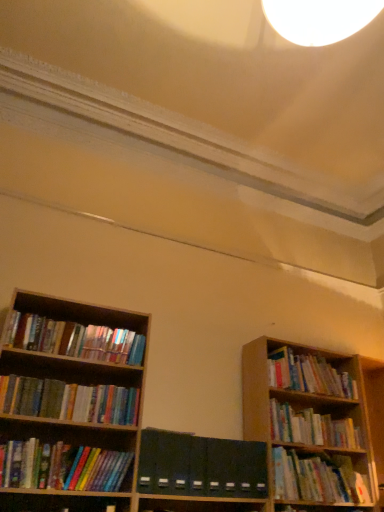
Where is `dark green matte folder at center`? This screenshot has width=384, height=512. dark green matte folder at center is located at coordinates (201, 465).

Locate an element on the screen. hardcover books at right, which is the 5th book in left-to-right order is located at coordinates (312, 428).

The width and height of the screenshot is (384, 512). Identify the location of hardcover books at left, which ranks as the fifth book in right-to-left order. (74, 339).

Describe the element at coordinates (317, 478) in the screenshot. I see `hardcover books at lower right, which appears as the 4th book when viewed from the left` at that location.

This screenshot has height=512, width=384. In order to click on hardcover books at lower right, the third book positioned from the right in this screenshot , I will do `click(317, 478)`.

Find the location of `wooden bookshelf at right, which is the 6th book in left-to-right order`. wooden bookshelf at right, which is the 6th book in left-to-right order is located at coordinates (308, 374).

Could you tell me if hardcover books at lower left, the 3th book in the left-to-right sequence, is facing dark green matte folder at center?

No, hardcover books at lower left, the 3th book in the left-to-right sequence, is not turned towards dark green matte folder at center.

Could you measure the distance between hardcover books at lower left, the 3th book in the left-to-right sequence, and dark green matte folder at center?

16.04 inches.

From the image's perspective, which is above, hardcover books at lower left, the fourth book in the right-to-left sequence, or dark green matte folder at center?

hardcover books at lower left, the fourth book in the right-to-left sequence, appears higher in the image.

Considering the relative sizes of hardcover books at lower left, the fourth book in the right-to-left sequence, and dark green matte folder at center in the image provided, is hardcover books at lower left, the fourth book in the right-to-left sequence, shorter than dark green matte folder at center?

Yes, hardcover books at lower left, the fourth book in the right-to-left sequence, is shorter than dark green matte folder at center.

Is hardcover books at lower right, which appears as the 4th book when viewed from the left, to the right of multicolored paperbacks at left, acting as the first book starting from the left, from the viewer's perspective?

Yes.

Who is taller, hardcover books at lower right, the third book positioned from the right, or multicolored paperbacks at left, which is the 6th book in right-to-left order?

Standing taller between the two is hardcover books at lower right, the third book positioned from the right.

Considering the sizes of hardcover books at lower right, which appears as the 4th book when viewed from the left, and multicolored paperbacks at left, acting as the first book starting from the left, in the image, is hardcover books at lower right, which appears as the 4th book when viewed from the left, bigger or smaller than multicolored paperbacks at left, acting as the first book starting from the left,?

Considering their sizes, hardcover books at lower right, which appears as the 4th book when viewed from the left, takes up more space than multicolored paperbacks at left, acting as the first book starting from the left.

Is hardcover books at lower right, which appears as the 4th book when viewed from the left, positioned with its back to multicolored paperbacks at left, acting as the first book starting from the left?

No, hardcover books at lower right, which appears as the 4th book when viewed from the left, is not facing the opposite direction of multicolored paperbacks at left, acting as the first book starting from the left.

Could you tell me if dark green matte folder at center is turned towards hardcover books at left, the second book viewed from the left?

No, dark green matte folder at center is not turned towards hardcover books at left, the second book viewed from the left.

Considering the points (244, 469) and (29, 349), which point is in front, point (244, 469) or point (29, 349)?

Point (29, 349)

From a real-world perspective, between dark green matte folder at center and hardcover books at left, which ranks as the fifth book in right-to-left order, who is vertically lower?

dark green matte folder at center.

Is dark green matte folder at center outside of hardcover books at left, which ranks as the fifth book in right-to-left order?

Absolutely, dark green matte folder at center is external to hardcover books at left, which ranks as the fifth book in right-to-left order.

Can you confirm if hardcover books at lower left, the fourth book in the right-to-left sequence, is thinner than hardcover books at right, the 2th book positioned from the right?

Indeed, hardcover books at lower left, the fourth book in the right-to-left sequence, has a lesser width compared to hardcover books at right, the 2th book positioned from the right.

From the image's perspective, between hardcover books at lower left, the fourth book in the right-to-left sequence, and hardcover books at right, the 2th book positioned from the right, who is located below?

hardcover books at right, the 2th book positioned from the right, is shown below in the image.

Are hardcover books at lower left, the 3th book in the left-to-right sequence, and hardcover books at right, the 2th book positioned from the right, making contact?

There is a gap between hardcover books at lower left, the 3th book in the left-to-right sequence, and hardcover books at right, the 2th book positioned from the right.

Considering the sizes of hardcover books at lower left, the fourth book in the right-to-left sequence, and hardcover books at right, which is the 5th book in left-to-right order, in the image, is hardcover books at lower left, the fourth book in the right-to-left sequence, bigger or smaller than hardcover books at right, which is the 5th book in left-to-right order,?

Considering their sizes, hardcover books at lower left, the fourth book in the right-to-left sequence, takes up less space than hardcover books at right, which is the 5th book in left-to-right order.

From the picture: Could you measure the distance between hardcover books at right, the 2th book positioned from the right, and hardcover books at left, the second book viewed from the left?

hardcover books at right, the 2th book positioned from the right, and hardcover books at left, the second book viewed from the left, are 1.25 meters apart from each other.

From the image's perspective, starting from the hardcover books at left, the second book viewed from the left, which book is the 4th one below? Please provide its 2D coordinates.

[(312, 428)]

Which of these two, hardcover books at right, the 2th book positioned from the right, or hardcover books at left, the second book viewed from the left, is thinner?

With smaller width is hardcover books at left, the second book viewed from the left.

Does hardcover books at right, the 2th book positioned from the right, turn towards hardcover books at left, which ranks as the fifth book in right-to-left order?

No, hardcover books at right, the 2th book positioned from the right, is not turned towards hardcover books at left, which ranks as the fifth book in right-to-left order.

What's the angular difference between dark green matte folder at center and hardcover books at lower left, the 3th book in the left-to-right sequence,'s facing directions?

There is a 0.133-degree angle between the facing directions of dark green matte folder at center and hardcover books at lower left, the 3th book in the left-to-right sequence.

Is dark green matte folder at center facing away from hardcover books at lower left, the 3th book in the left-to-right sequence?

No, dark green matte folder at center is not facing the opposite direction of hardcover books at lower left, the 3th book in the left-to-right sequence.

In the scene shown: From a real-world perspective, which object stands above the other?

dark green matte folder at center, from a real-world perspective.

From the image's perspective, who appears lower, dark green matte folder at center or hardcover books at lower left, the 3th book in the left-to-right sequence?

dark green matte folder at center is shown below in the image.

Considering the relative sizes of multicolored paperbacks at left, acting as the first book starting from the left, and hardcover books at lower left, the 3th book in the left-to-right sequence, in the image provided, is multicolored paperbacks at left, acting as the first book starting from the left, taller than hardcover books at lower left, the 3th book in the left-to-right sequence,?

In fact, multicolored paperbacks at left, acting as the first book starting from the left, may be shorter than hardcover books at lower left, the 3th book in the left-to-right sequence.

Does multicolored paperbacks at left, which is the 6th book in right-to-left order, have a greater width compared to hardcover books at lower left, the fourth book in the right-to-left sequence?

Yes.

Can you tell me how much multicolored paperbacks at left, which is the 6th book in right-to-left order, and hardcover books at lower left, the 3th book in the left-to-right sequence, differ in facing direction?

They differ by 0.000629 degrees in their facing directions.

Is multicolored paperbacks at left, acting as the first book starting from the left, aimed at hardcover books at lower left, the 3th book in the left-to-right sequence?

No, multicolored paperbacks at left, acting as the first book starting from the left, is not oriented towards hardcover books at lower left, the 3th book in the left-to-right sequence.

Where is `paperback book below the hardcover books at lower left, the fourth book in the right-to-left sequence (from the image's perspective)`? The width and height of the screenshot is (384, 512). paperback book below the hardcover books at lower left, the fourth book in the right-to-left sequence (from the image's perspective) is located at coordinates (201, 465).

Where is `the 2nd book in front when counting from the hardcover books at lower right, which appears as the 4th book when viewed from the left`? the 2nd book in front when counting from the hardcover books at lower right, which appears as the 4th book when viewed from the left is located at coordinates (69, 401).

In the scene shown: From the image, which object appears to be nearer to multicolored paperbacks at left, acting as the first book starting from the left, hardcover books at right, the 2th book positioned from the right, or wooden bookshelf at right, the 1th book viewed from the right?

wooden bookshelf at right, the 1th book viewed from the right, is positioned closer to the anchor multicolored paperbacks at left, acting as the first book starting from the left.

Considering their positions, is multicolored paperbacks at left, acting as the first book starting from the left, positioned further to wooden bookshelf at right, which is the 6th book in left-to-right order, than hardcover books at right, the 2th book positioned from the right?

The object further to wooden bookshelf at right, which is the 6th book in left-to-right order, is multicolored paperbacks at left, acting as the first book starting from the left.

From the image, which object appears to be nearer to dark green matte folder at center, hardcover books at left, the second book viewed from the left, or multicolored paperbacks at left, acting as the first book starting from the left?

Among the two, multicolored paperbacks at left, acting as the first book starting from the left, is located nearer to dark green matte folder at center.

From the image, which object appears to be farther from hardcover books at right, the 2th book positioned from the right, hardcover books at lower left, the fourth book in the right-to-left sequence, or multicolored paperbacks at left, which is the 6th book in right-to-left order?

hardcover books at lower left, the fourth book in the right-to-left sequence, is positioned further to the anchor hardcover books at right, the 2th book positioned from the right.

Estimate the real-world distances between objects in this image. Which object is further from dark green matte folder at center, hardcover books at left, the second book viewed from the left, or hardcover books at right, which is the 5th book in left-to-right order?

hardcover books at left, the second book viewed from the left, is further to dark green matte folder at center.

Looking at the image, which one is located further to hardcover books at right, the 2th book positioned from the right, hardcover books at left, which ranks as the fifth book in right-to-left order, or dark green matte folder at center?

hardcover books at left, which ranks as the fifth book in right-to-left order, lies further to hardcover books at right, the 2th book positioned from the right, than the other object.

In the scene shown: Which object lies nearer to the anchor point hardcover books at left, the second book viewed from the left, multicolored paperbacks at left, which is the 6th book in right-to-left order, or wooden bookshelf at right, the 1th book viewed from the right?

The object closer to hardcover books at left, the second book viewed from the left, is multicolored paperbacks at left, which is the 6th book in right-to-left order.

Considering their positions, is hardcover books at right, the 2th book positioned from the right, positioned further to multicolored paperbacks at left, which is the 6th book in right-to-left order, than dark green matte folder at center?

The object further to multicolored paperbacks at left, which is the 6th book in right-to-left order, is hardcover books at right, the 2th book positioned from the right.

Find the location of `paperback book between hardcover books at lower left, the fourth book in the right-to-left sequence, and wooden bookshelf at right, the 1th book viewed from the right, from left to right`. paperback book between hardcover books at lower left, the fourth book in the right-to-left sequence, and wooden bookshelf at right, the 1th book viewed from the right, from left to right is located at coordinates (201, 465).

Image resolution: width=384 pixels, height=512 pixels. In order to click on paperback book located between hardcover books at left, which ranks as the fifth book in right-to-left order, and hardcover books at lower right, the third book positioned from the right, in the left-right direction in this screenshot , I will do `click(201, 465)`.

Find the location of a particular element. The width and height of the screenshot is (384, 512). book between hardcover books at left, which ranks as the fifth book in right-to-left order, and dark green matte folder at center is located at coordinates (62, 467).

Where is `paperback book between hardcover books at left, the second book viewed from the left, and wooden bookshelf at right, the 1th book viewed from the right, from left to right`? paperback book between hardcover books at left, the second book viewed from the left, and wooden bookshelf at right, the 1th book viewed from the right, from left to right is located at coordinates (201, 465).